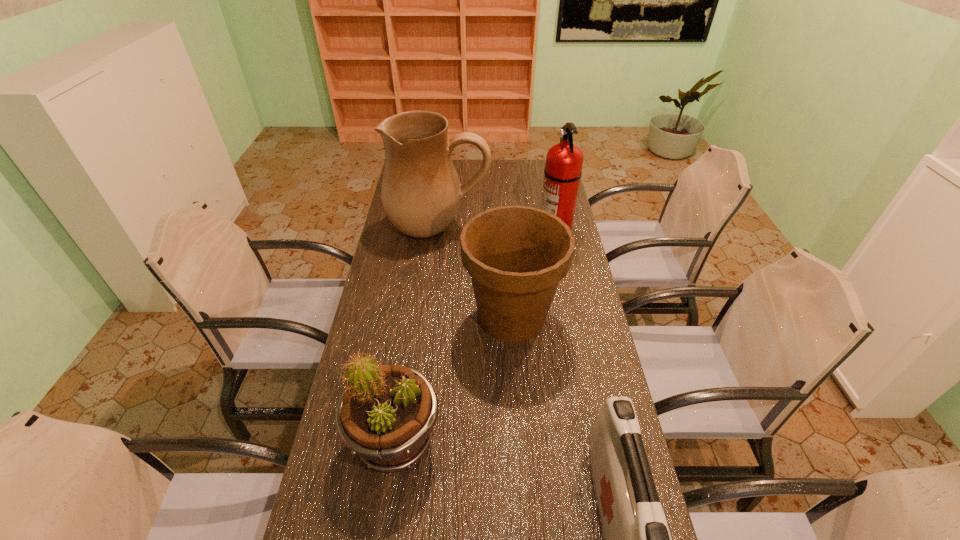
Identify the location of fire extinguisher. This screenshot has width=960, height=540. (564, 161).

The width and height of the screenshot is (960, 540). I want to click on cream pitcher, so click(x=421, y=192).

At what (x,y) coordinates should I click in order to perform the action: click on the third farthest object. Please return your answer as a coordinate pair (x, y). This screenshot has width=960, height=540. Looking at the image, I should click on (516, 255).

Locate an element on the screen. the right flowerpot is located at coordinates (516, 255).

You are a GUI agent. You are given a task and a screenshot of the screen. Output one action in this format:
    pyautogui.click(x=<x>, y=<y>)
    Task: Click on the left flowerpot
    Image resolution: width=960 pixels, height=540 pixels.
    Given the screenshot: What is the action you would take?
    pyautogui.click(x=386, y=416)

Locate an element on the screen. The image size is (960, 540). vacant region located 0.220m at the nozzle of the fire extinguisher is located at coordinates (486, 229).

Where is `vacant space situated 0.390m at the nozzle of the fire extinguisher`? vacant space situated 0.390m at the nozzle of the fire extinguisher is located at coordinates (444, 229).

The width and height of the screenshot is (960, 540). In order to click on vacant point located 0.390m at the nozzle of the fire extinguisher in this screenshot , I will do `click(444, 229)`.

This screenshot has height=540, width=960. What are the coordinates of `free space located 0.350m at the spout of the cream pitcher` in the screenshot? It's located at (428, 315).

Image resolution: width=960 pixels, height=540 pixels. Identify the location of blank area located on the back of the third nearest object. (508, 269).